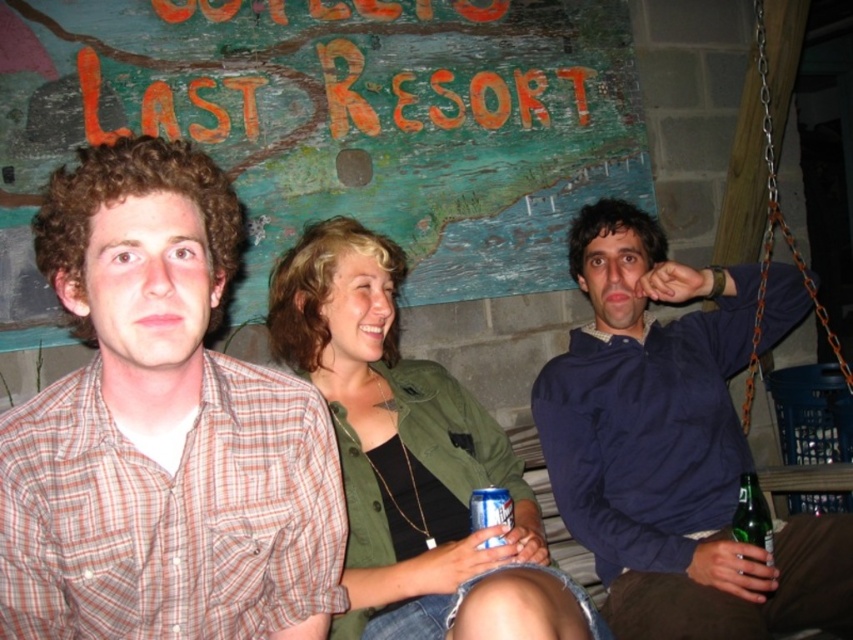
You are a bartender who needs to place a new order for shirts and cans. Given the sizes of the blue cotton shirt at right and the blue metallic can at center in the image, which item would you order more of if you need to fill a display case that can hold items of their respective sizes?

The blue cotton shirt at right has a larger size compared to the blue metallic can at center, so you should order fewer shirts and more cans to fill the display case efficiently.

You are a photographer trying to capture a closeup of the blue metallic can at center without the green matte jacket at center blocking the view. Can you fit the can into the frame while keeping the jacket out of the shot?

The green matte jacket at center might be wider than blue metallic can at center, so there is a possibility that the jacket could block the view of the can. To ensure the jacket stays out of the frame, you may need to adjust your angle or position to account for its width compared to the can.

You are trying to reach the green matte jacket at center to hand someone an item. There is a blue cotton shirt at right in the way. Can you pass through the space between them?

The blue cotton shirt at right is positioned over green matte jacket at center, so there is no space between them. You cannot pass through the space between them.